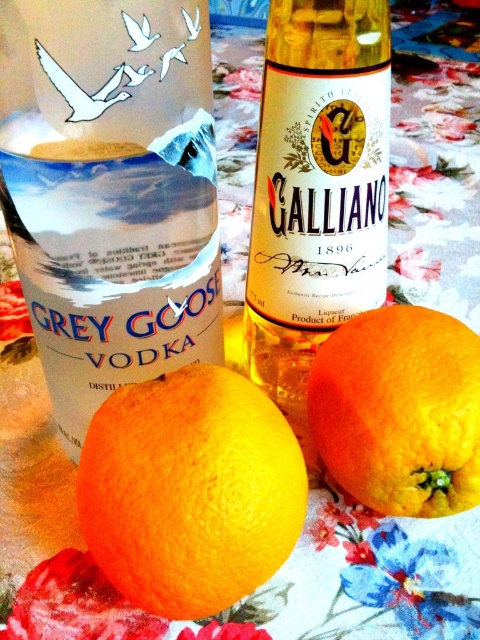
Does point (110, 24) come closer to viewer compared to point (477, 422)?

Yes, it is.

Which is behind, point (119, 284) or point (431, 456)?

The point (119, 284) is behind.

You are a GUI agent. You are given a task and a screenshot of the screen. Output one action in this format:
    pyautogui.click(x=<x>, y=<y>)
    Task: Click on the clear glass bottle at lower left
    The height and width of the screenshot is (640, 480).
    Given the screenshot: What is the action you would take?
    pyautogui.click(x=110, y=192)

Can you confirm if clear glass bottle at lower left is smaller than yellow glass bottle at center?

Yes, clear glass bottle at lower left is smaller than yellow glass bottle at center.

Does point (10, 180) come in front of point (377, 269)?

That is True.

Does point (153, 353) come in front of point (332, 172)?

Yes, it is in front of point (332, 172).

The height and width of the screenshot is (640, 480). Find the location of `clear glass bottle at lower left`. clear glass bottle at lower left is located at coordinates (110, 192).

Does point (323, 67) come farther from viewer compared to point (386, 364)?

That is True.

The width and height of the screenshot is (480, 640). I want to click on yellow glass bottle at center, so click(x=316, y=189).